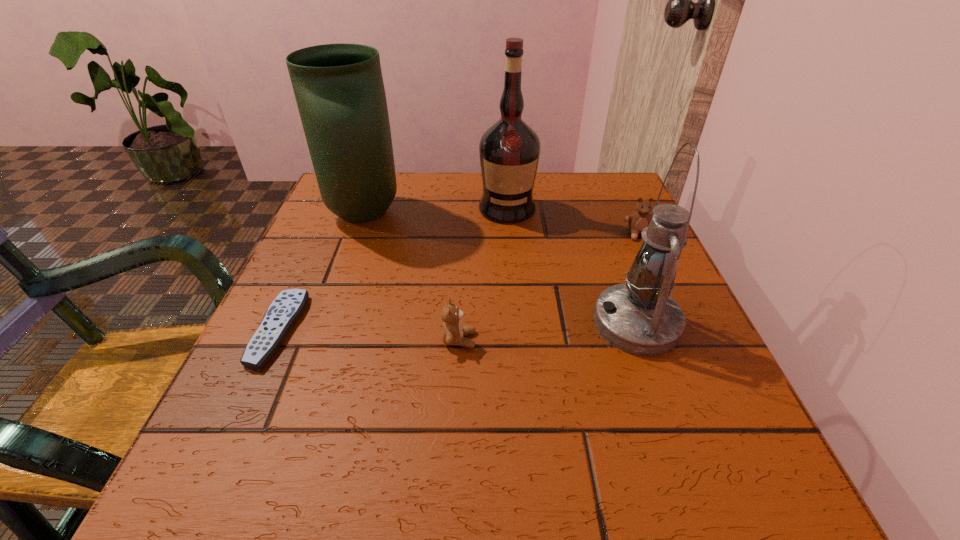
You are a GUI agent. You are given a task and a screenshot of the screen. Output one action in this format:
    pyautogui.click(x=<x>, y=<y>)
    Task: Click on the vacant space located on the front-facing side of the third object from left to right
    
    Given the screenshot: What is the action you would take?
    pyautogui.click(x=702, y=340)

I want to click on vacant position located on the front-facing side of the farther teddy bear, so click(x=664, y=291).

This screenshot has width=960, height=540. Identify the location of vacant space located on the front of the remote control. (238, 418).

Image resolution: width=960 pixels, height=540 pixels. I want to click on liquor that is positioned at the far edge, so click(509, 151).

Locate an element on the screen. vase that is positioned at the far edge is located at coordinates click(x=339, y=89).

You are a GUI agent. You are given a task and a screenshot of the screen. Output one action in this format:
    pyautogui.click(x=<x>, y=<y>)
    Task: Click on the vase that is at the left edge
    This screenshot has width=960, height=540.
    Given the screenshot: What is the action you would take?
    pyautogui.click(x=339, y=89)

Find the location of a particular element. remote control at the left edge is located at coordinates (287, 307).

The height and width of the screenshot is (540, 960). I want to click on oil lamp that is at the right edge, so click(x=639, y=317).

You are a GUI agent. You are given a task and a screenshot of the screen. Output one action in this format:
    pyautogui.click(x=<x>, y=<y>)
    Task: Click on the teddy bear positioned at the right edge
    This screenshot has width=960, height=540.
    Given the screenshot: What is the action you would take?
    pyautogui.click(x=640, y=219)

Locate an element on the screen. The image size is (960, 540). object present at the far left corner is located at coordinates (339, 89).